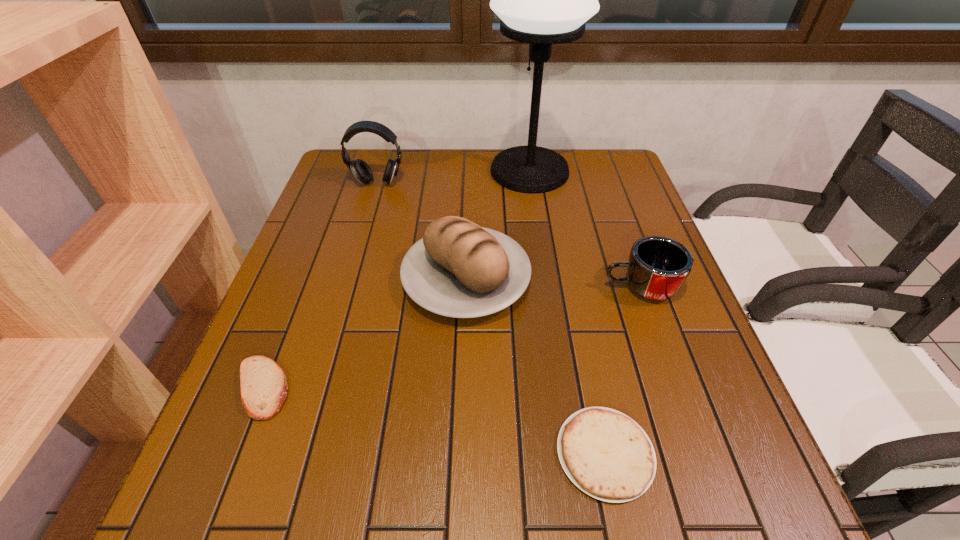
Where is `free location that satisfies the following two spatial constraints: 1. on the ear cups of the earphone; 2. on the right side of the tortilla`? The height and width of the screenshot is (540, 960). free location that satisfies the following two spatial constraints: 1. on the ear cups of the earphone; 2. on the right side of the tortilla is located at coordinates (298, 453).

Find the location of `free spot that satisfies the following two spatial constraints: 1. on the back side of the pita bread; 2. on the left side of the table lamp`. free spot that satisfies the following two spatial constraints: 1. on the back side of the pita bread; 2. on the left side of the table lamp is located at coordinates (348, 171).